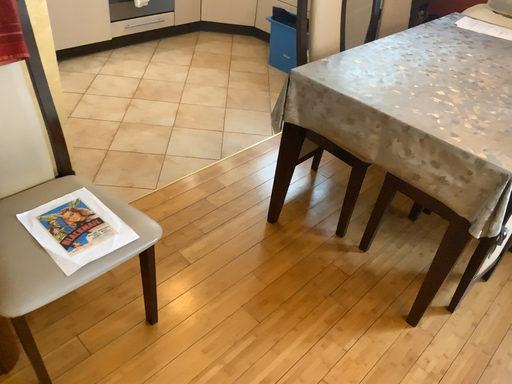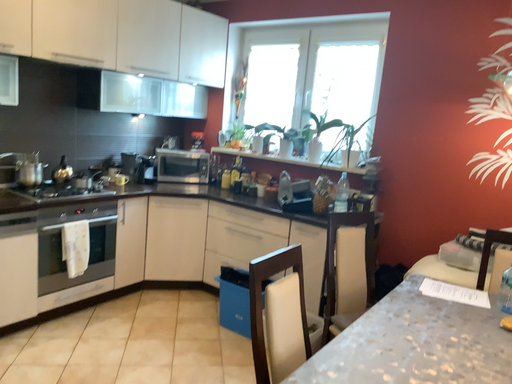
Question: How did the camera likely rotate when shooting the video?

Choices:
 (A) rotated upward
 (B) rotated downward

Answer: (A)